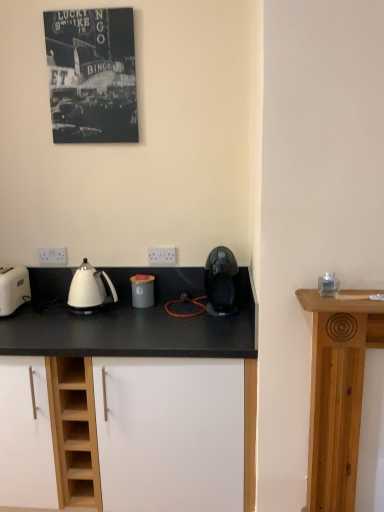
This screenshot has height=512, width=384. I want to click on white plastic toaster at left, so click(x=13, y=289).

The width and height of the screenshot is (384, 512). What do you see at coordinates (13, 289) in the screenshot? I see `white plastic toaster at left` at bounding box center [13, 289].

The width and height of the screenshot is (384, 512). Describe the element at coordinates (142, 290) in the screenshot. I see `matte gray canister at center, the 1th kitchen appliance in the left-to-right sequence` at that location.

What are the coordinates of `matte gray canister at center, the 1th kitchen appliance in the left-to-right sequence` in the screenshot? It's located at (142, 290).

This screenshot has height=512, width=384. What do you see at coordinates (128, 433) in the screenshot? I see `white matte cabinet at center` at bounding box center [128, 433].

How much space does white plastic electric outlet at lower left, which is counted as the 1th electric outlet, starting from the back, occupy vertically?

white plastic electric outlet at lower left, which is counted as the 1th electric outlet, starting from the back, is 3.82 inches tall.

This screenshot has width=384, height=512. In order to click on white plastic electric outlet at lower left, the second electric outlet positioned from the right in this screenshot , I will do `click(52, 256)`.

The height and width of the screenshot is (512, 384). I want to click on white plastic toaster at left, so click(13, 289).

Is the position of white plastic electric outlet at center, the 2th electric outlet when ordered from left to right, less distant than that of clear glass candle at upper right?

No.

Based on the photo, how much distance is there between white plastic electric outlet at center, marked as the 1th electric outlet in a right-to-left arrangement, and clear glass candle at upper right?

They are 38.27 inches apart.

Based on the photo, is white plastic electric outlet at center, arranged as the first electric outlet when viewed from the front, positioned far away from clear glass candle at upper right?

No, white plastic electric outlet at center, arranged as the first electric outlet when viewed from the front, is not far from clear glass candle at upper right.

Consider the image. Is white plastic electric outlet at center, the second electric outlet from the back, oriented towards clear glass candle at upper right?

No, white plastic electric outlet at center, the second electric outlet from the back, does not turn towards clear glass candle at upper right.

From the image's perspective, is white plastic electric outlet at lower left, which appears as the second electric outlet when viewed from the front, beneath white matte cabinet at center?

Incorrect, from the image's perspective, white plastic electric outlet at lower left, which appears as the second electric outlet when viewed from the front, is higher than white matte cabinet at center.

Does white plastic electric outlet at lower left, the first electric outlet positioned from the left, have a smaller size compared to white matte cabinet at center?

Indeed, white plastic electric outlet at lower left, the first electric outlet positioned from the left, has a smaller size compared to white matte cabinet at center.

Is white plastic electric outlet at lower left, the second electric outlet positioned from the right, in contact with white matte cabinet at center?

No, white plastic electric outlet at lower left, the second electric outlet positioned from the right, is not touching white matte cabinet at center.

Is white plastic electric outlet at lower left, the second electric outlet positioned from the right, taller or shorter than white matte cabinet at center?

Clearly, white plastic electric outlet at lower left, the second electric outlet positioned from the right, is shorter compared to white matte cabinet at center.

Is black plastic coffee machine at center, acting as the 1th kitchen appliance starting from the right, placed right next to white plastic electric outlet at lower left, the first electric outlet positioned from the left?

No, black plastic coffee machine at center, acting as the 1th kitchen appliance starting from the right, is not making contact with white plastic electric outlet at lower left, the first electric outlet positioned from the left.

Does black plastic coffee machine at center, the second kitchen appliance in the left-to-right sequence, lie behind white plastic electric outlet at lower left, which is counted as the 1th electric outlet, starting from the back?

No, black plastic coffee machine at center, the second kitchen appliance in the left-to-right sequence, is in front of white plastic electric outlet at lower left, which is counted as the 1th electric outlet, starting from the back.

From the image's perspective, which object appears higher, black plastic coffee machine at center, acting as the 1th kitchen appliance starting from the right, or white plastic electric outlet at lower left, the second electric outlet positioned from the right?

white plastic electric outlet at lower left, the second electric outlet positioned from the right.

Who is taller, black plastic coffee machine at center, acting as the 1th kitchen appliance starting from the right, or white plastic electric outlet at lower left, which is counted as the 1th electric outlet, starting from the back?

black plastic coffee machine at center, acting as the 1th kitchen appliance starting from the right.

Does white matte cabinet at center appear on the left side of white plastic electric outlet at center, the second electric outlet from the back?

Yes, white matte cabinet at center is to the left of white plastic electric outlet at center, the second electric outlet from the back.

From a real-world perspective, is white matte cabinet at center above or below white plastic electric outlet at center, the 2th electric outlet when ordered from left to right?

In terms of real-world spatial position, white matte cabinet at center is below white plastic electric outlet at center, the 2th electric outlet when ordered from left to right.

The width and height of the screenshot is (384, 512). In order to click on cabinetry that is below the white plastic electric outlet at center, marked as the 1th electric outlet in a right-to-left arrangement (from the image's perspective) in this screenshot , I will do `click(128, 433)`.

How different are the orientations of white glossy kettle at left and black canvas poster at upper left in degrees?

white glossy kettle at left and black canvas poster at upper left are facing 1.91 degrees away from each other.

In the scene shown: From the image's perspective, between white glossy kettle at left and black canvas poster at upper left, which one is located above?

black canvas poster at upper left is shown above in the image.

Is white glossy kettle at left facing towards black canvas poster at upper left?

No, white glossy kettle at left is not turned towards black canvas poster at upper left.

How far apart are black canvas poster at upper left and white matte cabinet at center?

black canvas poster at upper left and white matte cabinet at center are 1.34 meters apart.

From the image's perspective, which is below, black canvas poster at upper left or white matte cabinet at center?

white matte cabinet at center, from the image's perspective.

Does black canvas poster at upper left have a smaller size compared to white matte cabinet at center?

Yes.

Considering the relative sizes of black canvas poster at upper left and white matte cabinet at center in the image provided, is black canvas poster at upper left thinner than white matte cabinet at center?

Yes, black canvas poster at upper left is thinner than white matte cabinet at center.

Considering the positions of point (226, 276) and point (322, 286), is point (226, 276) closer or farther from the camera than point (322, 286)?

Point (226, 276) is positioned farther from the camera compared to point (322, 286).

Based on the photo, between black plastic coffee machine at center, acting as the 1th kitchen appliance starting from the right, and clear glass candle at upper right, which one is positioned in front?

clear glass candle at upper right is more forward.

Do you think black plastic coffee machine at center, acting as the 1th kitchen appliance starting from the right, is within clear glass candle at upper right, or outside of it?

black plastic coffee machine at center, acting as the 1th kitchen appliance starting from the right, lies outside clear glass candle at upper right.

The height and width of the screenshot is (512, 384). What are the coordinates of `the 1st electric outlet behind the clear glass candle at upper right` in the screenshot? It's located at (161, 256).

I want to click on cabinetry in front of the white plastic electric outlet at lower left, which is counted as the 1th electric outlet, starting from the back, so click(x=128, y=433).

Which object lies nearer to the anchor point black canvas poster at upper left, white matte cabinet at center or white plastic toaster at left?

Among the two, white plastic toaster at left is located nearer to black canvas poster at upper left.

Which object lies further to the anchor point white plastic toaster at left, white glossy kettle at left or black plastic coffee machine at center, the second kitchen appliance in the left-to-right sequence?

Based on the image, black plastic coffee machine at center, the second kitchen appliance in the left-to-right sequence, appears to be further to white plastic toaster at left.

From the image, which object appears to be nearer to black canvas poster at upper left, white plastic toaster at left or black plastic coffee machine at center, the second kitchen appliance in the left-to-right sequence?

Based on the image, white plastic toaster at left appears to be nearer to black canvas poster at upper left.

Estimate the real-world distances between objects in this image. Which object is closer to black canvas poster at upper left, white plastic electric outlet at lower left, the second electric outlet positioned from the right, or white glossy kettle at left?

white plastic electric outlet at lower left, the second electric outlet positioned from the right, is closer to black canvas poster at upper left.

Which object lies nearer to the anchor point white plastic electric outlet at center, arranged as the first electric outlet when viewed from the front, white plastic toaster at left or white matte cabinet at center?

Among the two, white plastic toaster at left is located nearer to white plastic electric outlet at center, arranged as the first electric outlet when viewed from the front.

Looking at the image, which one is located further to white plastic electric outlet at lower left, which appears as the second electric outlet when viewed from the front, white matte cabinet at center or white glossy kettle at left?

white matte cabinet at center.

Consider the image. Estimate the real-world distances between objects in this image. Which object is further from white plastic electric outlet at lower left, the first electric outlet positioned from the left, white plastic toaster at left or white glossy kettle at left?

The object further to white plastic electric outlet at lower left, the first electric outlet positioned from the left, is white glossy kettle at left.

Based on their spatial positions, is white matte cabinet at center or white glossy kettle at left further from black canvas poster at upper left?

white matte cabinet at center is positioned further to the anchor black canvas poster at upper left.

The image size is (384, 512). In order to click on kitchen appliance that lies between black canvas poster at upper left and white plastic toaster at left from top to bottom in this screenshot , I will do `click(221, 281)`.

Identify the location of appliance that lies between black canvas poster at upper left and black plastic coffee machine at center, acting as the 1th kitchen appliance starting from the right, from top to bottom. coord(328,285).

The image size is (384, 512). I want to click on electric outlet between white glossy kettle at left and black plastic coffee machine at center, acting as the 1th kitchen appliance starting from the right, so click(161, 256).

You are a GUI agent. You are given a task and a screenshot of the screen. Output one action in this format:
    pyautogui.click(x=<x>, y=<y>)
    Task: Click on the toaster that lies between black canvas poster at upper left and matte gray canister at center, the 1th kitchen appliance in the left-to-right sequence, from top to bottom
    
    Given the screenshot: What is the action you would take?
    pyautogui.click(x=13, y=289)